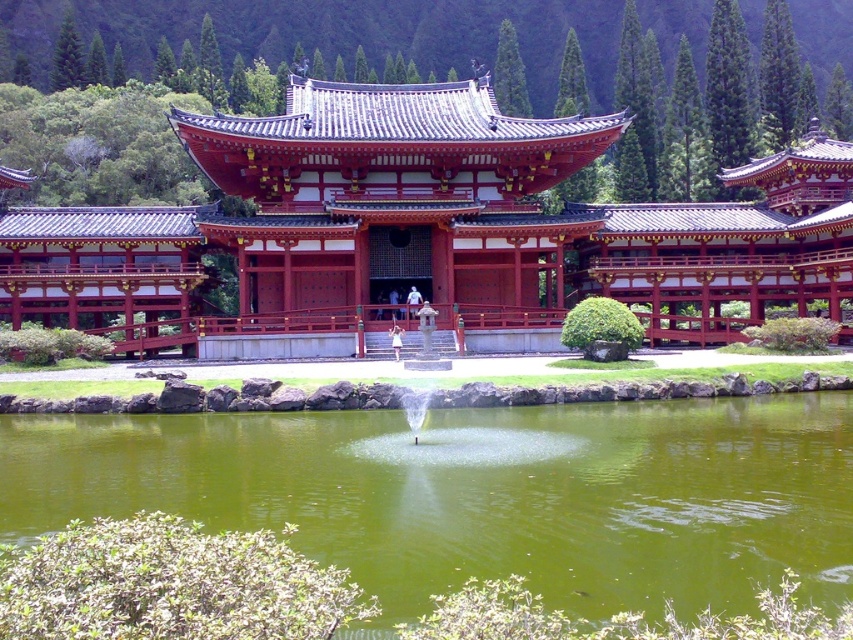
Is matte red pagoda at center smaller than green liquid water at center?

No, matte red pagoda at center is not smaller than green liquid water at center.

Can you confirm if matte red pagoda at center is bigger than green liquid water at center?

Correct, matte red pagoda at center is larger in size than green liquid water at center.

Is point (554, 227) behind point (198, 508)?

Yes, it is.

Where is `matte red pagoda at center`? This screenshot has height=640, width=853. matte red pagoda at center is located at coordinates (426, 227).